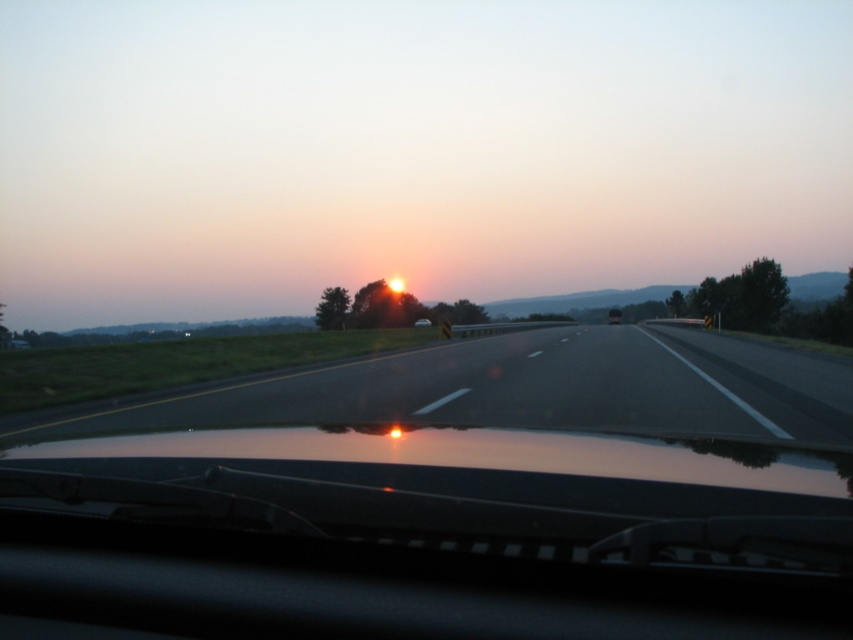
Is black asphalt highway at center to the right of matte black car at center from the viewer's perspective?

No, black asphalt highway at center is not to the right of matte black car at center.

Is point (715, 413) in front of point (614, 308)?

Yes, point (715, 413) is closer to viewer.

Where is `black asphalt highway at center`? black asphalt highway at center is located at coordinates (519, 388).